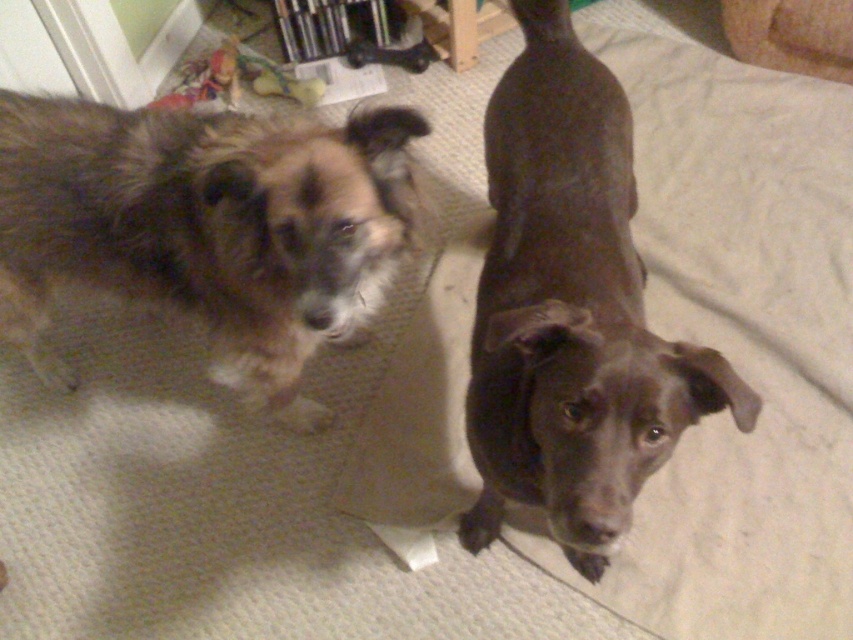
Who is shorter, brown fuzzy dog at left or shiny brown dog at center?

With less height is brown fuzzy dog at left.

Is point (177, 131) in front of point (650, 420)?

No, (177, 131) is behind (650, 420).

The width and height of the screenshot is (853, 640). What are the coordinates of `brown fuzzy dog at left` in the screenshot? It's located at (206, 227).